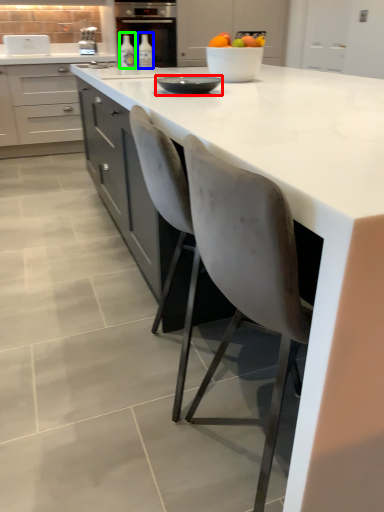
Question: Which is farther away from tableware (highlighted by a red box)? bottle (highlighted by a blue box) or bottle (highlighted by a green box)?

Choices:
 (A) bottle
 (B) bottle

Answer: (A)